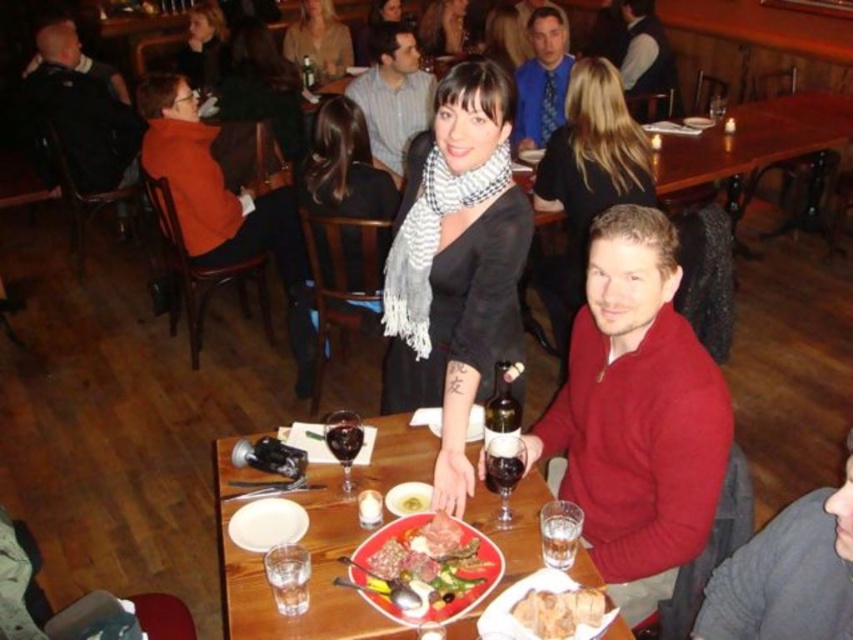
Question: Observing the image, what is the correct spatial positioning of golden brown bread at center in reference to smooth leather jacket at upper center?

Choices:
 (A) below
 (B) above

Answer: (A)

Question: Which point appears farthest from the camera in this image?

Choices:
 (A) (524, 461)
 (B) (263, 196)

Answer: (B)

Question: Which point is closer to the camera?

Choices:
 (A) (331, 26)
 (B) (514, 483)
 (C) (554, 13)

Answer: (B)

Question: Which point is closer to the camera?

Choices:
 (A) click(625, 38)
 (B) click(320, 592)
 (C) click(357, 436)
 (D) click(265, 545)

Answer: (B)

Question: Does wooden table at center have a lesser width compared to velvet vest at upper center?

Choices:
 (A) no
 (B) yes

Answer: (A)

Question: Does striped scarf at center appear over smooth leather jacket at upper center?

Choices:
 (A) yes
 (B) no

Answer: (B)